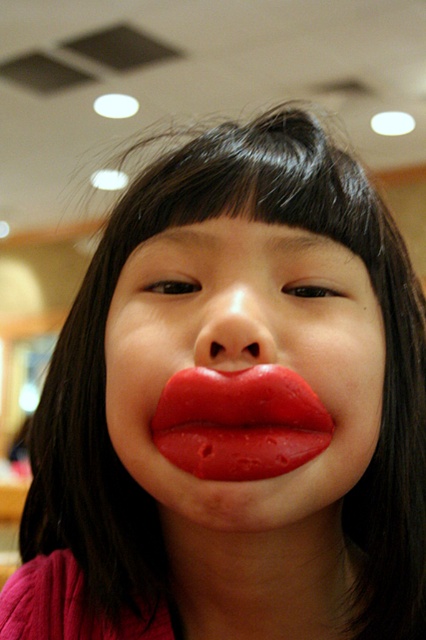
You are a photographer adjusting the focus on your camera. The subject has glossy red lips at center. Where should you aim the focus point to ensure the lips are sharp?

The glossy red lips at center are located at point (239, 422), so aim the focus point there to ensure sharpness.

You are a makeup artist analyzing a photo of a person with dark hair and bangs. The photo shows two sets of lips at the center of the image. One is labeled as shiny red lips at center and the other as glossy red lips at center. Which of these two lips is positioned higher in the image?

The shiny red lips at center are positioned higher than the glossy red lips at center in the image.

You are a makeup artist trying to apply lipstick symmetrically. You observe the shiny red lips at center and the glossy red lips at center in the image. Which one is taller?

The shiny red lips at center is taller than glossy red lips at center.